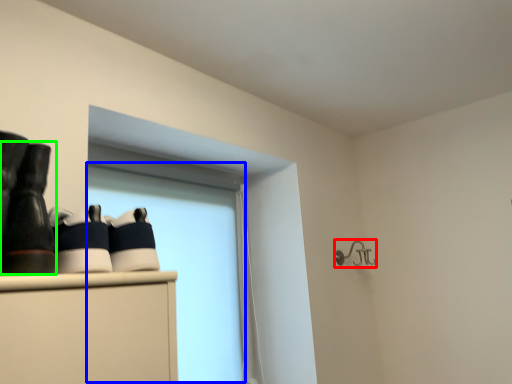
Question: Estimate the real-world distances between objects in this image. Which object is closer to shower (highlighted by a red box), window screen (highlighted by a blue box) or footwear (highlighted by a green box)?

Choices:
 (A) window screen
 (B) footwear

Answer: (A)